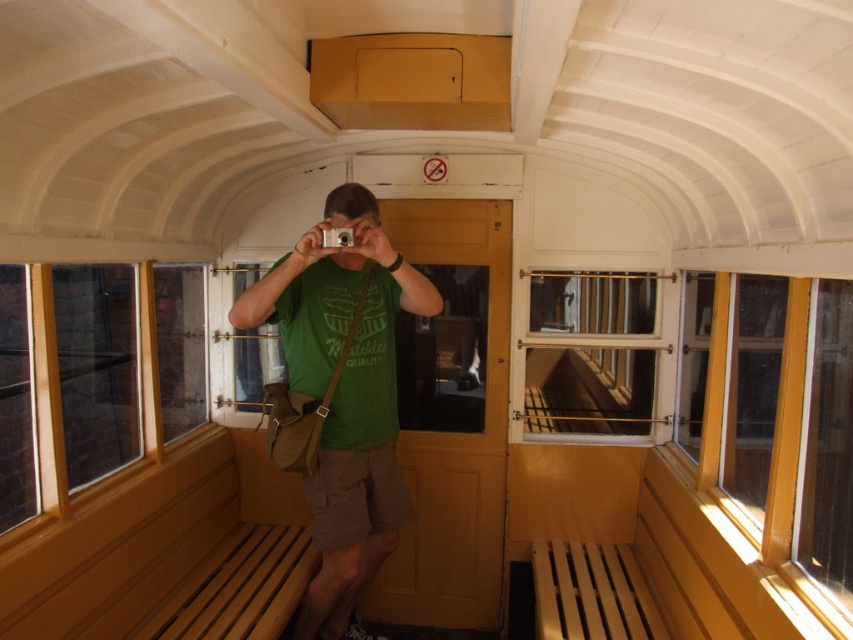
Question: Can you confirm if green fabric shirt at center is positioned above wooden slats at center?

Choices:
 (A) no
 (B) yes

Answer: (A)

Question: Is green fabric shirt at center in front of wooden slats at center?

Choices:
 (A) no
 (B) yes

Answer: (B)

Question: Which of the following is the farthest from the observer?

Choices:
 (A) (579, 401)
 (B) (323, 380)

Answer: (A)

Question: Is green fabric shirt at center in front of wooden slats at center?

Choices:
 (A) no
 (B) yes

Answer: (B)

Question: Which of the following is the farthest from the observer?

Choices:
 (A) green fabric shirt at center
 (B) wooden slats at center

Answer: (B)